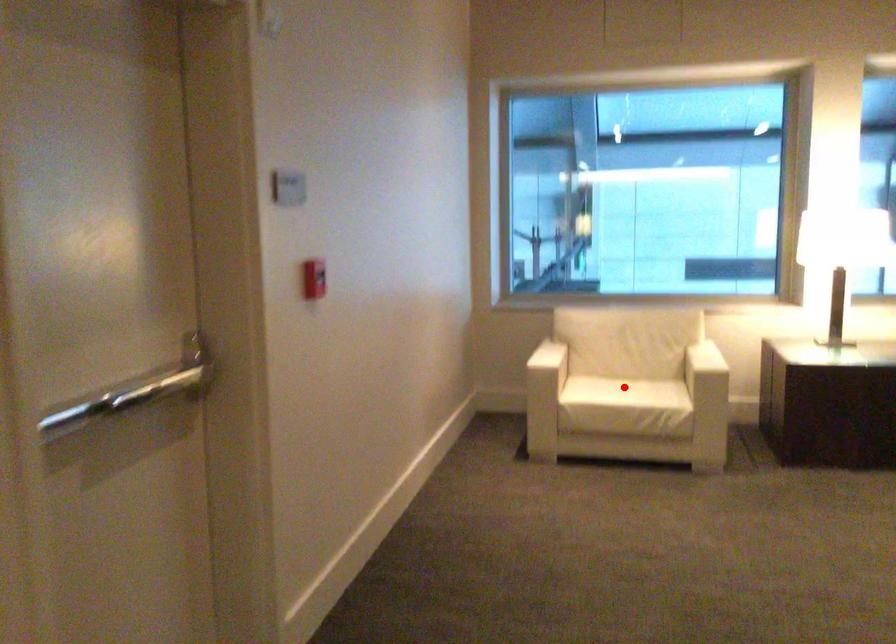
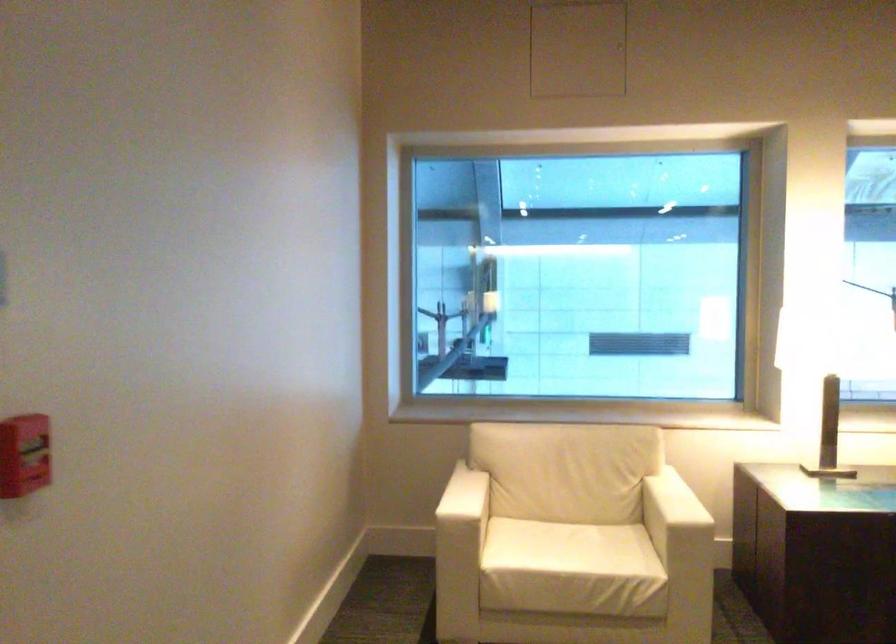
Question: I am providing you with two images of the same scene from different viewpoints. Given a red point in image1, look at the same physical point in image2. Is it:

Choices:
 (A) Closer to the viewpoint
 (B) Farther from the viewpoint

Answer: (A)